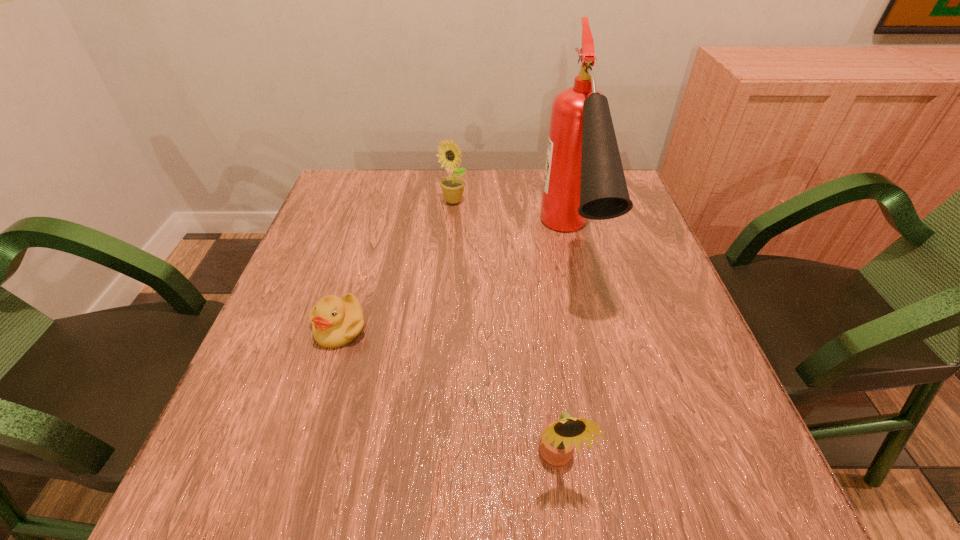
Where is `vacant space located on the front-facing side of the leftmost object`? vacant space located on the front-facing side of the leftmost object is located at coordinates (299, 464).

You are a GUI agent. You are given a task and a screenshot of the screen. Output one action in this format:
    pyautogui.click(x=<x>, y=<y>)
    Task: Click on the fire extinguisher positioned at the far edge
    This screenshot has height=540, width=960.
    Given the screenshot: What is the action you would take?
    [584, 179]

In order to click on sunflower that is positioned at the far edge in this screenshot , I will do `click(453, 186)`.

Locate an element on the screen. object that is at the near edge is located at coordinates [x=558, y=439].

What are the coordinates of `object that is at the left edge` in the screenshot? It's located at (x=335, y=321).

At what (x,y) coordinates should I click in order to perform the action: click on object that is at the right edge. Please return your answer as a coordinate pair (x, y). Looking at the image, I should click on (584, 179).

The width and height of the screenshot is (960, 540). What are the coordinates of `object at the far right corner` in the screenshot? It's located at (584, 179).

In the image, there is a desktop. Where is `vacant region at the far edge`? vacant region at the far edge is located at coordinates (488, 210).

The image size is (960, 540). I want to click on vacant area at the near edge, so click(557, 508).

The width and height of the screenshot is (960, 540). Find the location of `vacant area at the left edge of the desktop`. vacant area at the left edge of the desktop is located at coordinates (299, 383).